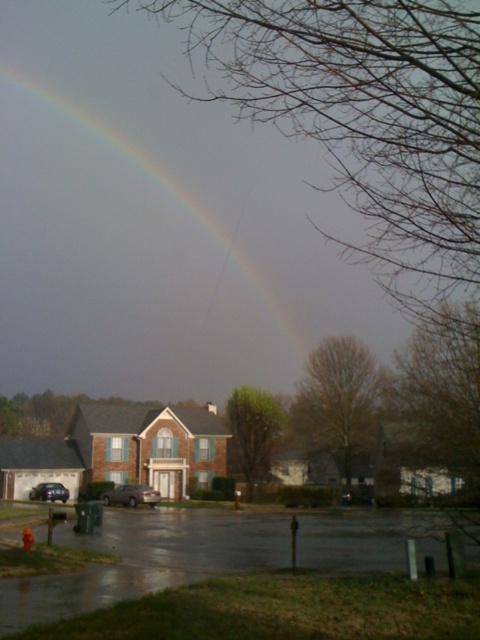
Identify the location of rainbow at upper center. (146, 248).

What are the coordinates of `rainbow at upper center` in the screenshot? It's located at (146, 248).

Which is behind, point (39, 284) or point (113, 492)?

Positioned behind is point (39, 284).

Who is positioned more to the right, rainbow at upper center or satin gold sedan at center?

satin gold sedan at center is more to the right.

Is point (140, 355) positioned in front of point (131, 492)?

No, (140, 355) is further to viewer.

Where is `rainbow at upper center`? This screenshot has height=640, width=480. rainbow at upper center is located at coordinates (146, 248).

Does wet asphalt at lower center have a greater width compared to shiny black sedan at lower left?

Indeed, wet asphalt at lower center has a greater width compared to shiny black sedan at lower left.

Can you confirm if wet asphalt at lower center is positioned above shiny black sedan at lower left?

Correct, wet asphalt at lower center is located above shiny black sedan at lower left.

This screenshot has height=640, width=480. Describe the element at coordinates (147, 560) in the screenshot. I see `wet asphalt at lower center` at that location.

What are the coordinates of `wet asphalt at lower center` in the screenshot? It's located at (147, 560).